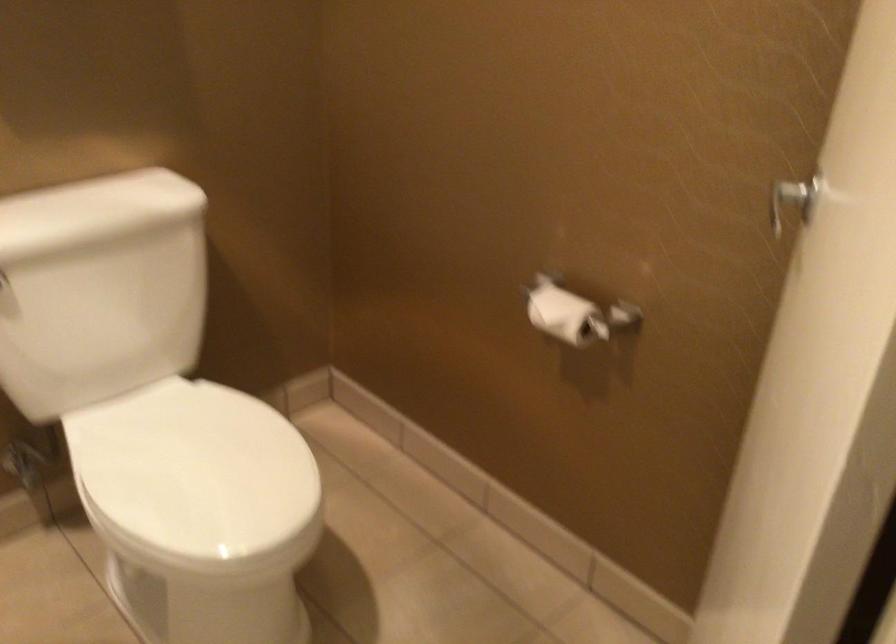
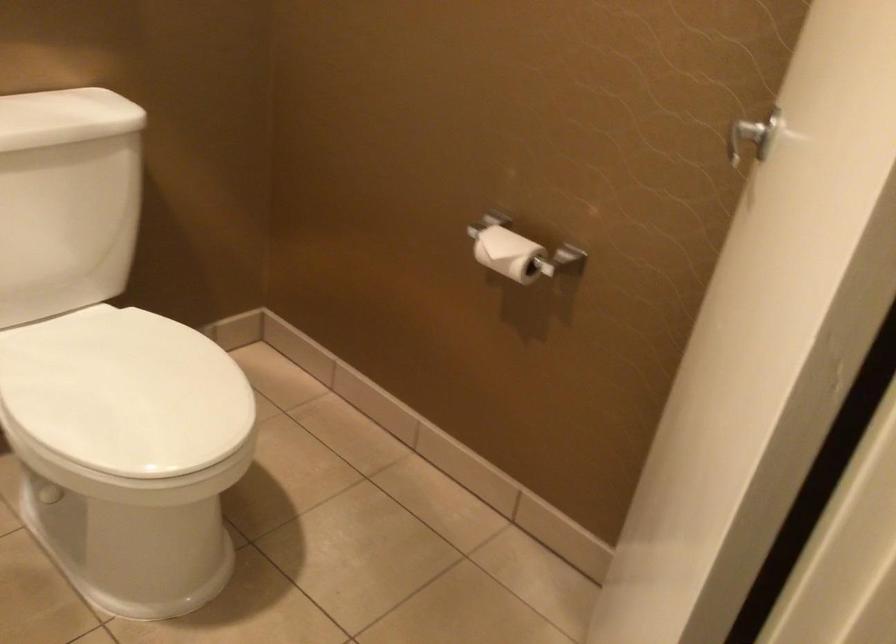
Find the pixel in the second image that matches [194,471] in the first image.

(125, 393)